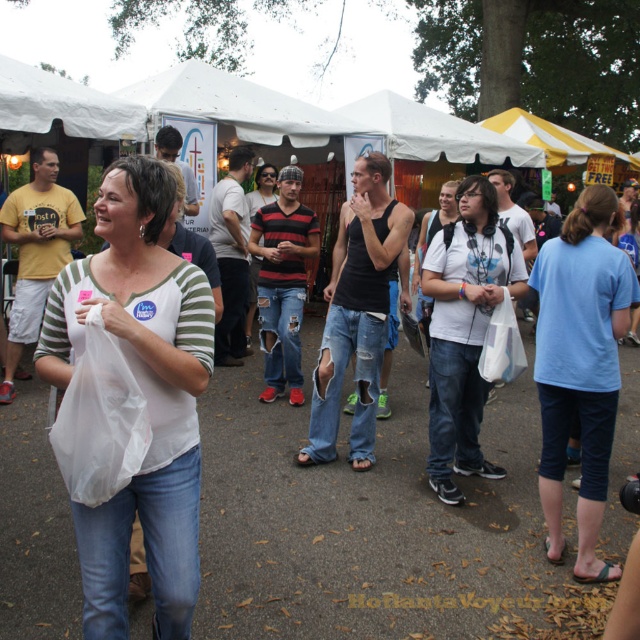
Question: Which of the following is the closest to the observer?

Choices:
 (A) (602, 493)
 (B) (182, 275)
 (C) (483, 216)

Answer: (B)

Question: Estimate the real-world distances between objects in this image. Which object is farther from the white matte plastic bag at left?

Choices:
 (A) white matte t-shirt at center
 (B) light blue cotton shirt at center

Answer: (B)

Question: Can you confirm if white matte plastic bag at left is thinner than light blue cotton shirt at center?

Choices:
 (A) yes
 (B) no

Answer: (B)

Question: Can you confirm if light blue cotton shirt at center is bigger than white matte t-shirt at center?

Choices:
 (A) no
 (B) yes

Answer: (A)

Question: Which object is positioned farthest from the white matte t-shirt at center?

Choices:
 (A) white matte plastic bag at left
 (B) light blue cotton shirt at center

Answer: (A)

Question: Does white matte plastic bag at left have a larger size compared to light blue cotton shirt at center?

Choices:
 (A) no
 (B) yes

Answer: (B)